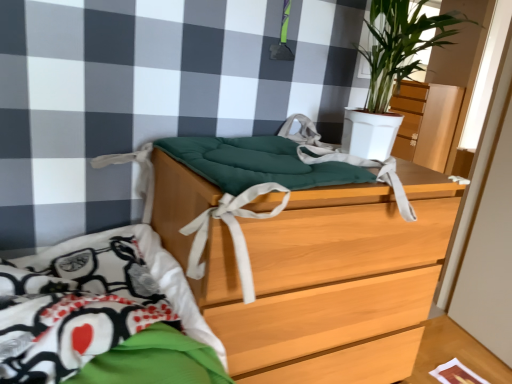
Where is `wooden chest of drawers at center`? wooden chest of drawers at center is located at coordinates (328, 271).

In the image, there is a green matte plant at upper right. Where is `dresser below it (from a real-world perspective)`? dresser below it (from a real-world perspective) is located at coordinates (426, 122).

Which is correct: matte wood dresser at upper right is inside green matte plant at upper right, or outside of it?

matte wood dresser at upper right exists outside the volume of green matte plant at upper right.

Does matte wood dresser at upper right lie behind green matte plant at upper right?

Yes, the depth of matte wood dresser at upper right is greater than that of green matte plant at upper right.

Does matte wood dresser at upper right have a greater width compared to green matte plant at upper right?

Indeed, matte wood dresser at upper right has a greater width compared to green matte plant at upper right.

Is matte wood dresser at upper right completely or partially inside green matte plant at upper right?

No, matte wood dresser at upper right is not surrounded by green matte plant at upper right.

Is green matte plant at upper right far from matte wood dresser at upper right?

Yes.

Is point (439, 37) positioned before point (406, 110)?

Yes, it is in front of point (406, 110).

From a real-world perspective, is green matte plant at upper right physically located above or below matte wood dresser at upper right?

green matte plant at upper right is situated higher than matte wood dresser at upper right in the real world.

Is wooden chest of drawers at center in front of or behind matte wood dresser at upper right in the image?

Visually, wooden chest of drawers at center is located in front of matte wood dresser at upper right.

From the picture: How different are the orientations of wooden chest of drawers at center and matte wood dresser at upper right in degrees?

They differ by 91.6 degrees in their facing directions.

Who is taller, wooden chest of drawers at center or matte wood dresser at upper right?

Standing taller between the two is wooden chest of drawers at center.

From a real-world perspective, is wooden chest of drawers at center located beneath matte wood dresser at upper right?

Indeed, from a real-world perspective, wooden chest of drawers at center is positioned beneath matte wood dresser at upper right.

Considering the relative sizes of matte wood dresser at upper right and wooden chest of drawers at center in the image provided, is matte wood dresser at upper right taller than wooden chest of drawers at center?

In fact, matte wood dresser at upper right may be shorter than wooden chest of drawers at center.

Does point (398, 147) lie in front of point (265, 266)?

No, (398, 147) is further to viewer.

In order to click on chest of drawers below the matte wood dresser at upper right (from the image's perspective) in this screenshot , I will do `click(328, 271)`.

Measure the distance from matte wood dresser at upper right to wooden chest of drawers at center.

matte wood dresser at upper right is 8.44 feet from wooden chest of drawers at center.

From their relative heights in the image, would you say wooden chest of drawers at center is taller or shorter than green matte plant at upper right?

Considering their sizes, wooden chest of drawers at center has more height than green matte plant at upper right.

From a real-world perspective, is wooden chest of drawers at center positioned above or below green matte plant at upper right?

wooden chest of drawers at center is situated lower than green matte plant at upper right in the real world.

Considering the positions of objects wooden chest of drawers at center and green matte plant at upper right in the image provided, who is behind, wooden chest of drawers at center or green matte plant at upper right?

green matte plant at upper right is behind.

Is there a large distance between wooden chest of drawers at center and green matte plant at upper right?

wooden chest of drawers at center is actually quite close to green matte plant at upper right.

In the scene shown: Does green matte plant at upper right turn towards wooden chest of drawers at center?

No, green matte plant at upper right is not aimed at wooden chest of drawers at center.

From a real-world perspective, is green matte plant at upper right physically located above or below wooden chest of drawers at center?

In terms of real-world spatial position, green matte plant at upper right is above wooden chest of drawers at center.

Does green matte plant at upper right come behind wooden chest of drawers at center?

Yes, green matte plant at upper right is further from the viewer.

Is green matte plant at upper right inside the boundaries of wooden chest of drawers at center, or outside?

green matte plant at upper right is located beyond the bounds of wooden chest of drawers at center.

Identify the location of houseplant that is in front of the matte wood dresser at upper right. (401, 45).

Identify the location of dresser directly beneath the green matte plant at upper right (from a real-world perspective). This screenshot has width=512, height=384. (426, 122).

Considering their positions, is green matte plant at upper right positioned further to wooden chest of drawers at center than matte wood dresser at upper right?

matte wood dresser at upper right lies further to wooden chest of drawers at center than the other object.

Estimate the real-world distances between objects in this image. Which object is further from green matte plant at upper right, matte wood dresser at upper right or wooden chest of drawers at center?

Among the two, matte wood dresser at upper right is located further to green matte plant at upper right.

From the image, which object appears to be farther from matte wood dresser at upper right, green matte plant at upper right or wooden chest of drawers at center?

Based on the image, wooden chest of drawers at center appears to be further to matte wood dresser at upper right.

From the image, which object appears to be farther from wooden chest of drawers at center, matte wood dresser at upper right or green matte plant at upper right?

matte wood dresser at upper right is further to wooden chest of drawers at center.

Looking at this image, from the image, which object appears to be farther from matte wood dresser at upper right, wooden chest of drawers at center or green matte plant at upper right?

Among the two, wooden chest of drawers at center is located further to matte wood dresser at upper right.

Which object lies further to the anchor point green matte plant at upper right, wooden chest of drawers at center or matte wood dresser at upper right?

Based on the image, matte wood dresser at upper right appears to be further to green matte plant at upper right.

In order to click on houseplant positioned between wooden chest of drawers at center and matte wood dresser at upper right from near to far in this screenshot , I will do `click(401, 45)`.